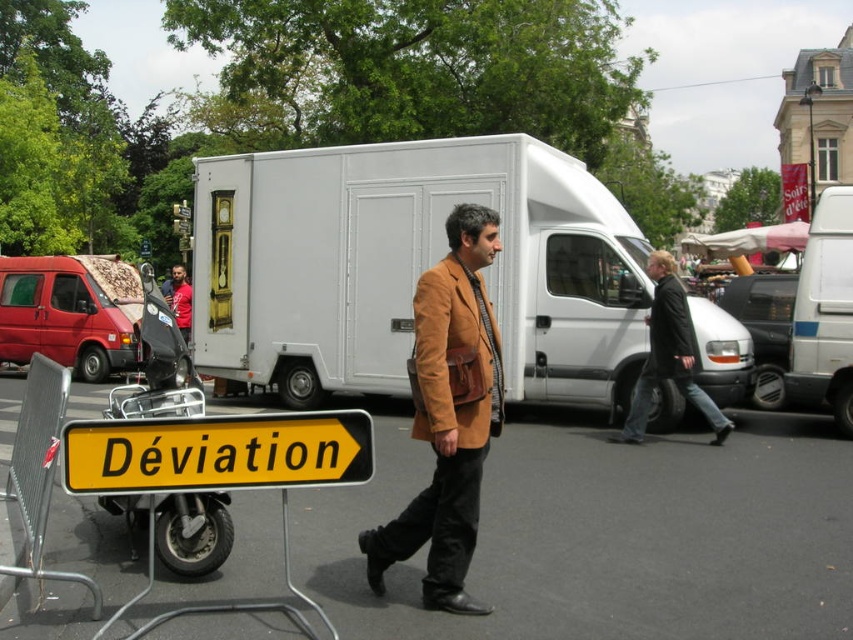
You are a pedestrian standing at the center of the street and see the dark brown leather jacket at center and the red fabric shirt at center. Which person is closer to you?

The dark brown leather jacket at center is closer to you because it is further to the viewer than the red fabric shirt at center.

From the picture: You are a delivery driver who needs to park your matte red van at left in a parking spot that can only accommodate vehicles narrower than the suede brown jacket at center. Can your van fit in the parking spot?

The matte red van at left is wider than the suede brown jacket at center, so it cannot fit in the parking spot designed for narrower vehicles.

Consider the image. You are a pedestrian standing at the intersection and see the black matte motorcycle at left and the dark brown leather jacket at center. Which object is closer to the road sign?

The black matte motorcycle at left is positioned under dark brown leather jacket at center, so the motorcycle is closer to the road sign.